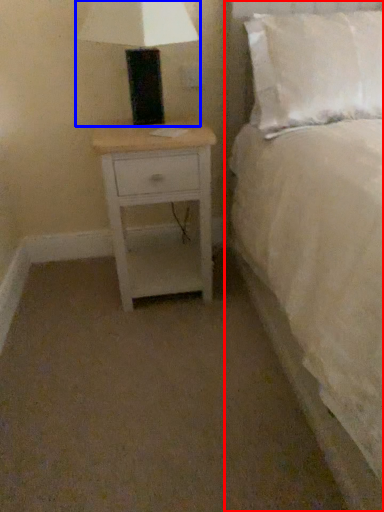
Question: Which of the following is the closest to the observer, bed (highlighted by a red box) or table lamp (highlighted by a blue box)?

Choices:
 (A) bed
 (B) table lamp

Answer: (A)